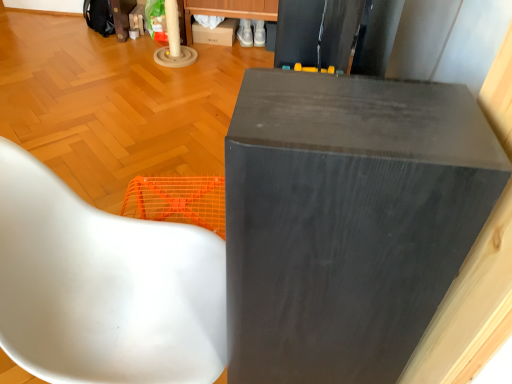
Question: Is matte cardboard box at upper center positioned with its back to matte black speaker at upper center?

Choices:
 (A) yes
 (B) no

Answer: (B)

Question: Are matte cardboard box at upper center and matte black speaker at upper center located far from each other?

Choices:
 (A) no
 (B) yes

Answer: (B)

Question: Does matte cardboard box at upper center have a lesser height compared to matte black speaker at upper center?

Choices:
 (A) yes
 (B) no

Answer: (A)

Question: Is matte cardboard box at upper center taller than matte black speaker at upper center?

Choices:
 (A) no
 (B) yes

Answer: (A)

Question: Is matte cardboard box at upper center outside of matte black speaker at upper center?

Choices:
 (A) yes
 (B) no

Answer: (A)

Question: From the image's perspective, is matte cardboard box at upper center under matte black speaker at upper center?

Choices:
 (A) yes
 (B) no

Answer: (B)

Question: Is matte black speaker at upper center positioned beyond the bounds of matte cardboard box at upper center?

Choices:
 (A) no
 (B) yes

Answer: (B)

Question: Is matte black speaker at upper center positioned in front of matte cardboard box at upper center?

Choices:
 (A) no
 (B) yes

Answer: (B)

Question: Can you confirm if matte black speaker at upper center is thinner than matte cardboard box at upper center?

Choices:
 (A) yes
 (B) no

Answer: (A)

Question: Is matte black speaker at upper center positioned behind matte cardboard box at upper center?

Choices:
 (A) no
 (B) yes

Answer: (A)

Question: Is matte black speaker at upper center taller than matte cardboard box at upper center?

Choices:
 (A) yes
 (B) no

Answer: (A)

Question: Does matte black speaker at upper center appear on the right side of matte cardboard box at upper center?

Choices:
 (A) yes
 (B) no

Answer: (A)

Question: Is white glossy chair at lower left oriented towards matte black speaker at upper center?

Choices:
 (A) yes
 (B) no

Answer: (A)